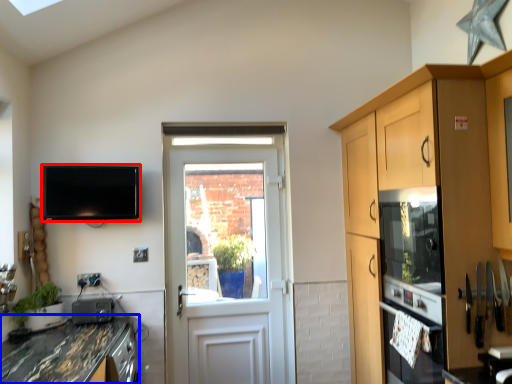
Question: Which object is closer to the camera taking this photo, television (highlighted by a red box) or countertop (highlighted by a blue box)?

Choices:
 (A) television
 (B) countertop

Answer: (B)